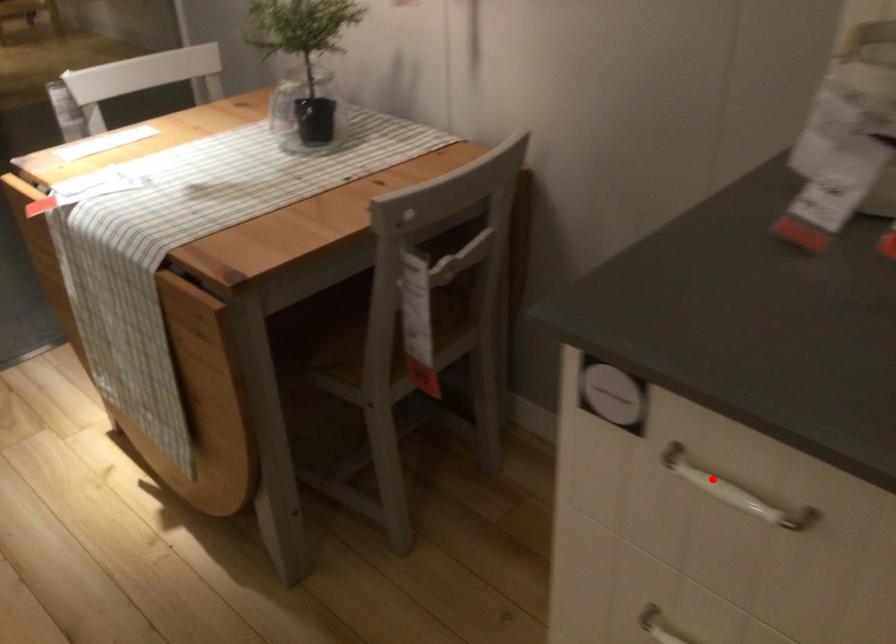
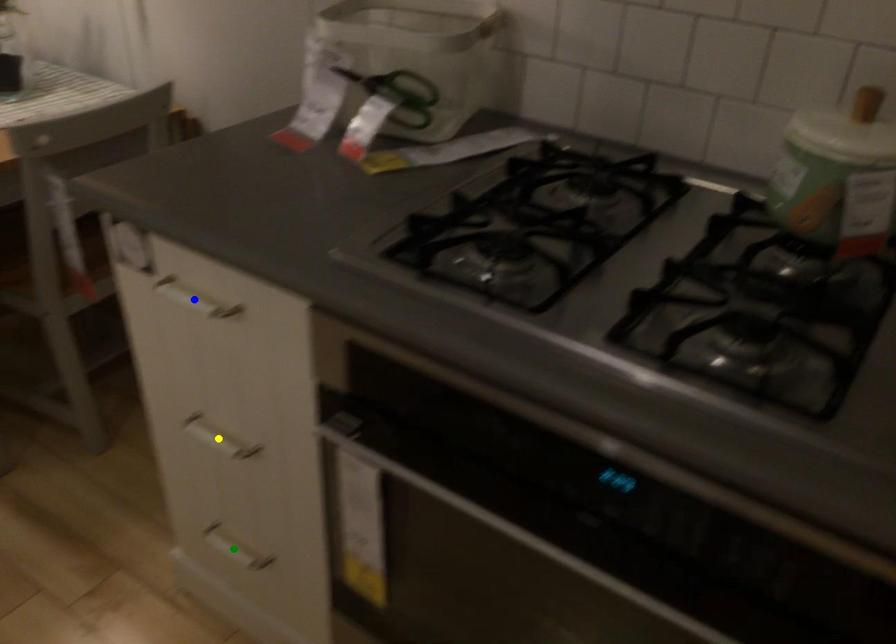
Question: I am providing you with two images of the same scene from different viewpoints. A red point is marked on the first image. You are given multiple points on the second image. Which mark in image 2 goes with the point in image 1?

Choices:
 (A) green point
 (B) yellow point
 (C) blue point

Answer: (C)